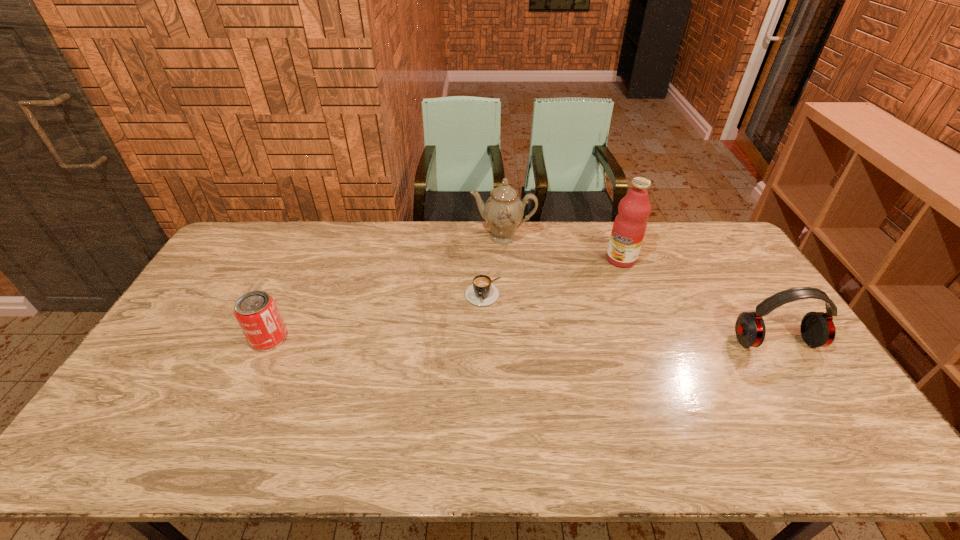
The width and height of the screenshot is (960, 540). In order to click on free spot located 0.130m on the spout of the farthest object in this screenshot , I will do `click(493, 272)`.

Where is `fruit juice positioned at the far edge`? The image size is (960, 540). fruit juice positioned at the far edge is located at coordinates (630, 224).

Image resolution: width=960 pixels, height=540 pixels. I want to click on chinaware that is at the far edge, so click(x=503, y=211).

Image resolution: width=960 pixels, height=540 pixels. Find the location of `object positioned at the right edge`. object positioned at the right edge is located at coordinates (817, 329).

This screenshot has height=540, width=960. Identify the location of free space at the far edge of the desktop. (397, 234).

In the image, there is a desktop. Identify the location of vacant space at the near edge. (482, 417).

The height and width of the screenshot is (540, 960). In the image, there is a desktop. Identify the location of free space at the left edge. (144, 368).

Where is `vacant area at the right edge`? The image size is (960, 540). vacant area at the right edge is located at coordinates (724, 278).

Find the location of a particular element. vacant space at the far left corner of the desktop is located at coordinates (254, 255).

Identify the location of free space between the fourth tallest object and the second farthest object. This screenshot has width=960, height=540. (445, 299).